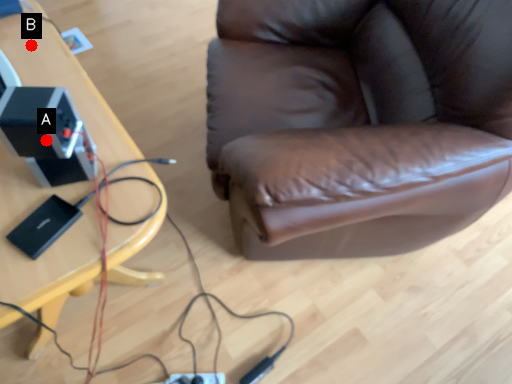
Question: Two points are circled on the image, labeled by A and B beside each circle. Which of the following is the farthest from the observer?

Choices:
 (A) A is further
 (B) B is further

Answer: (B)